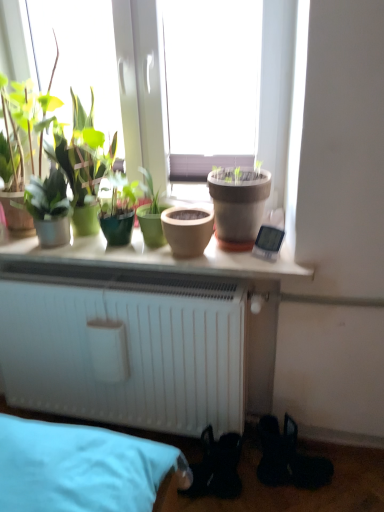
The height and width of the screenshot is (512, 384). Find the location of `vacant space in front of matte clay pot at center, which appears as the second flowerpot when viewed from the left`. vacant space in front of matte clay pot at center, which appears as the second flowerpot when viewed from the left is located at coordinates (254, 263).